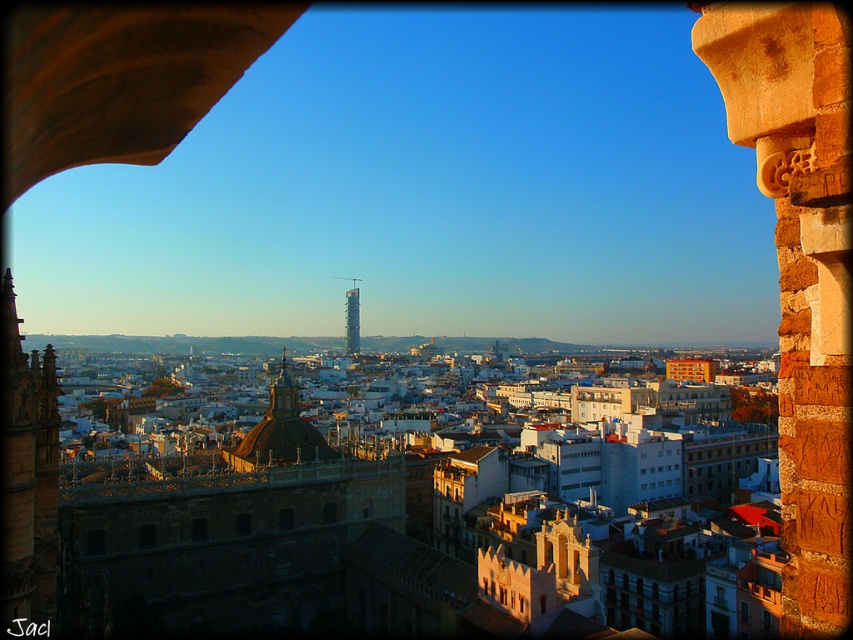
You are an architect analyzing the cityscape. You notice the brown stone column at center right and the metallic glass tower at center. Which structure has a greater height?

The brown stone column at center right is taller than the metallic glass tower at center.

What is the location of the brown stone column at center right in the cityscape image?

The brown stone column at center right is located at point 0.423 on the x axis and 0.940 on the y axis.